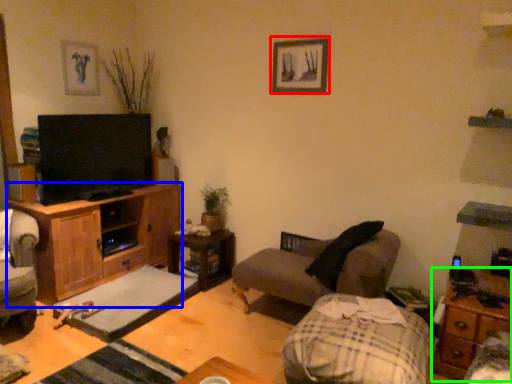
Question: Considering the real-world distances, which object is closest to picture frame (highlighted by a red box)? cabinetry (highlighted by a blue box) or nightstand (highlighted by a green box).

Choices:
 (A) cabinetry
 (B) nightstand

Answer: (A)